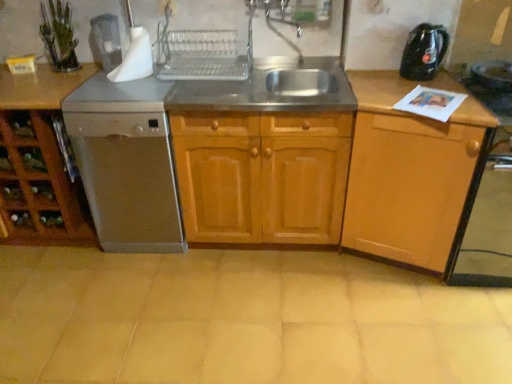
Identify the location of vacant point above satin silver dishwasher at left (from a real-world perspective). (124, 86).